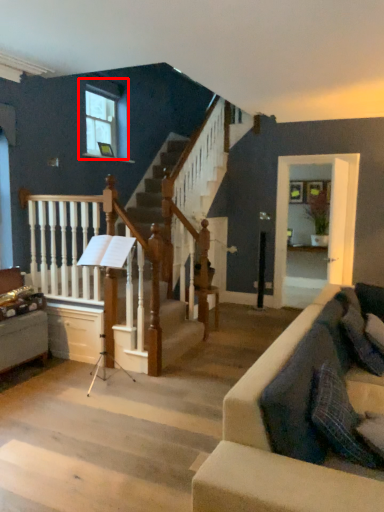
Question: From the image's perspective, where is window (annotated by the red box) located in relation to rail in the image?

Choices:
 (A) below
 (B) above

Answer: (B)